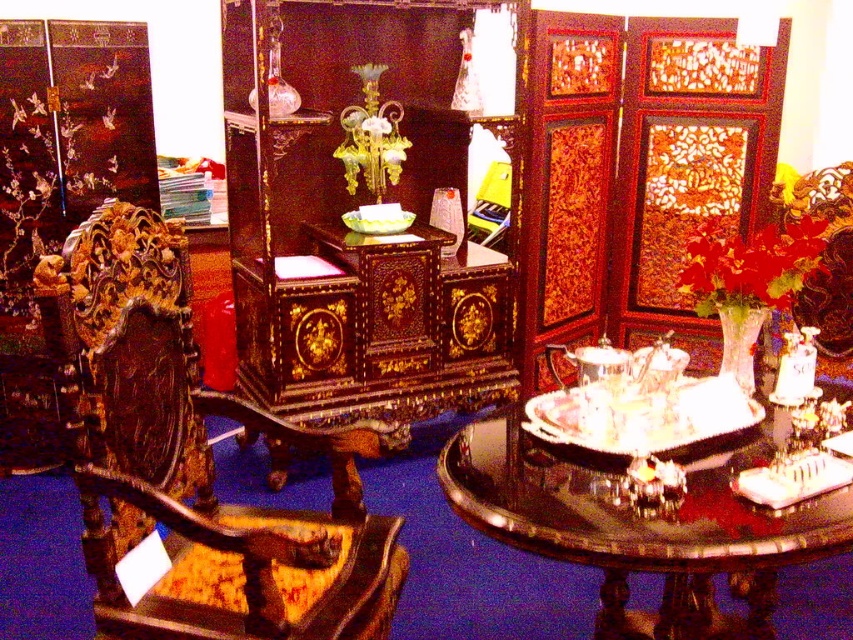
Between polished wood armchair at left and glossy wood tray at center, which one has less height?

With less height is glossy wood tray at center.

Does polished wood armchair at left appear under glossy wood tray at center?

No, polished wood armchair at left is not below glossy wood tray at center.

You are a GUI agent. You are given a task and a screenshot of the screen. Output one action in this format:
    pyautogui.click(x=<x>, y=<y>)
    Task: Click on the polished wood armchair at left
    This screenshot has width=853, height=640.
    Given the screenshot: What is the action you would take?
    pyautogui.click(x=192, y=458)